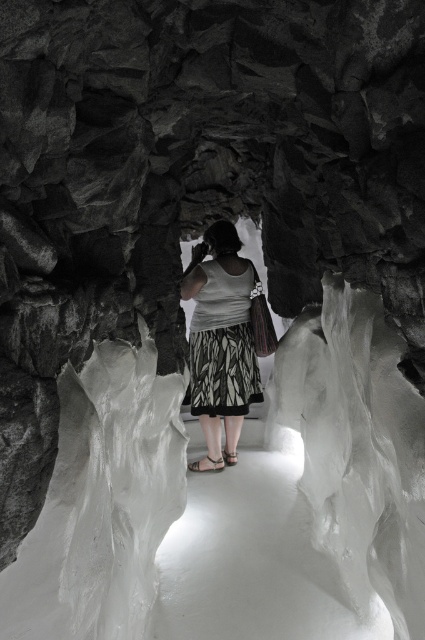
You are a traveler navigating through an icy tunnel. You notice a point marked at coordinates (223, 346). What object is located at this specific coordinate in the tunnel?

The point at coordinates (223, 346) marks the location of the printed fabric dress at center.

You are standing at the entrance of the icy tunnel and want to reach the point marked at coordinates point (209, 332). Given that the tunnel is narrow and the walls are rugged, can you estimate if you can safely walk straight to that point without touching the walls?

The distance between you and the point (209, 332) is 3.73 meters. Since the tunnel is narrow and has rugged walls, you must ensure your path is clear. However, the description does not provide information about the tunnel width or your body dimensions, so it is uncertain if you can walk straight without touching the walls.